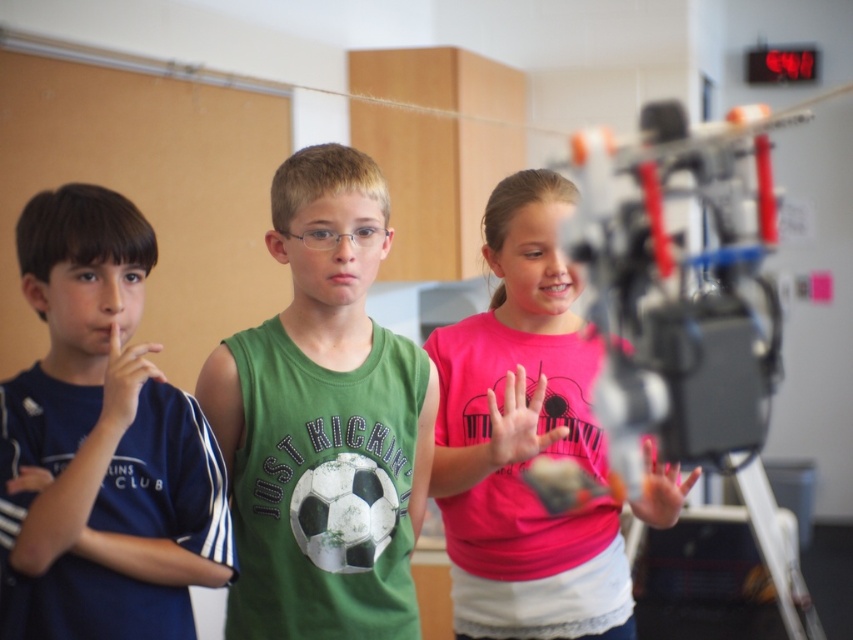
Question: Does metallic/plastic camera at right appear under matte skin hand at left?

Choices:
 (A) no
 (B) yes

Answer: (B)

Question: Among these objects, which one is farthest from the camera?

Choices:
 (A) pink matte shirt at center
 (B) matte skin hand at left
 (C) pink matte hand at center

Answer: (A)

Question: Can you confirm if matte skin hand at left is positioned below smooth skin hand at center?

Choices:
 (A) yes
 (B) no

Answer: (B)

Question: Which point is closer to the camera?

Choices:
 (A) (643, 400)
 (B) (444, 497)
 (C) (180, 420)
 (D) (155, 372)

Answer: (D)

Question: Which object is positioned farthest from the pink matte shirt at center?

Choices:
 (A) green matte tank top at center
 (B) pink matte hand at center

Answer: (A)

Question: Considering the relative positions of green matte tank top at center and pink matte shirt at center in the image provided, where is green matte tank top at center located with respect to pink matte shirt at center?

Choices:
 (A) left
 (B) right

Answer: (A)